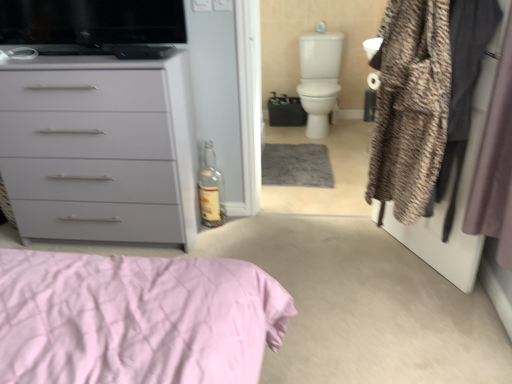
Question: Would you say fuzzy fabric coat at right is a long distance from matte gray chest of drawers at left?

Choices:
 (A) no
 (B) yes

Answer: (B)

Question: Considering the relative positions of fuzzy fabric coat at right and matte gray chest of drawers at left in the image provided, is fuzzy fabric coat at right to the right of matte gray chest of drawers at left from the viewer's perspective?

Choices:
 (A) yes
 (B) no

Answer: (A)

Question: Is fuzzy fabric coat at right wider than matte gray chest of drawers at left?

Choices:
 (A) no
 (B) yes

Answer: (A)

Question: Considering the relative sizes of fuzzy fabric coat at right and matte gray chest of drawers at left in the image provided, is fuzzy fabric coat at right thinner than matte gray chest of drawers at left?

Choices:
 (A) yes
 (B) no

Answer: (A)

Question: Can you confirm if fuzzy fabric coat at right is taller than matte gray chest of drawers at left?

Choices:
 (A) no
 (B) yes

Answer: (B)

Question: Is fuzzy fabric coat at right at the left side of matte gray chest of drawers at left?

Choices:
 (A) yes
 (B) no

Answer: (B)

Question: Can you confirm if matte gray chest of drawers at left is shorter than white glossy toilet bowl at upper right?

Choices:
 (A) no
 (B) yes

Answer: (A)

Question: Can you confirm if matte gray chest of drawers at left is thinner than white glossy toilet bowl at upper right?

Choices:
 (A) yes
 (B) no

Answer: (A)

Question: Considering the relative sizes of matte gray chest of drawers at left and white glossy toilet bowl at upper right in the image provided, is matte gray chest of drawers at left wider than white glossy toilet bowl at upper right?

Choices:
 (A) yes
 (B) no

Answer: (B)

Question: Can you confirm if matte gray chest of drawers at left is taller than white glossy toilet bowl at upper right?

Choices:
 (A) no
 (B) yes

Answer: (B)

Question: Does matte gray chest of drawers at left come in front of white glossy toilet bowl at upper right?

Choices:
 (A) yes
 (B) no

Answer: (A)

Question: Does matte gray chest of drawers at left come behind white glossy toilet bowl at upper right?

Choices:
 (A) no
 (B) yes

Answer: (A)

Question: Can you confirm if textured brown coat at right is thinner than white glossy toilet bowl at upper right?

Choices:
 (A) no
 (B) yes

Answer: (B)